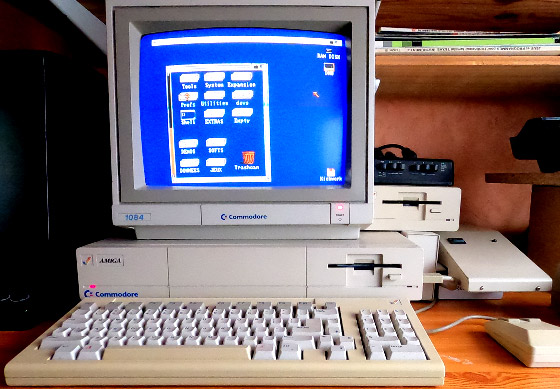
You are a GUI agent. You are given a task and a screenshot of the screen. Output one action in this format:
    pyautogui.click(x=<x>, y=<y>)
    Task: Click on the computer
    
    Given the screenshot: What is the action you would take?
    pyautogui.click(x=354, y=261)